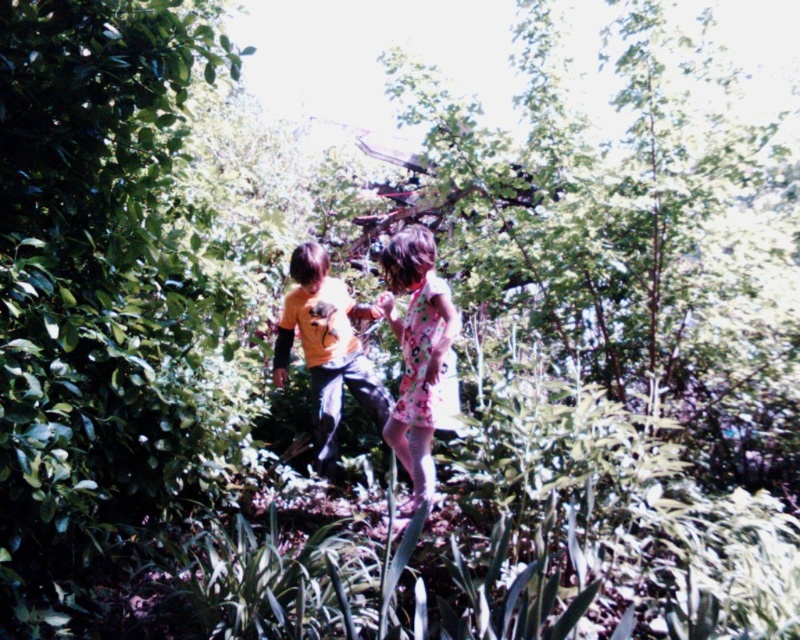
Question: Can you confirm if floral dress at center is positioned above orange matte shirt at center?

Choices:
 (A) no
 (B) yes

Answer: (A)

Question: Which point is closer to the camera taking this photo?

Choices:
 (A) [x=350, y=355]
 (B) [x=400, y=426]

Answer: (B)

Question: Does floral dress at center have a larger size compared to orange matte shirt at center?

Choices:
 (A) yes
 (B) no

Answer: (B)

Question: Where is floral dress at center located in relation to orange matte shirt at center in the image?

Choices:
 (A) right
 (B) left

Answer: (A)